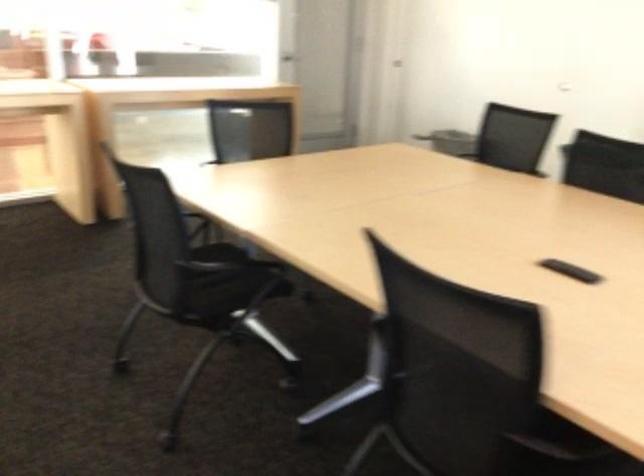
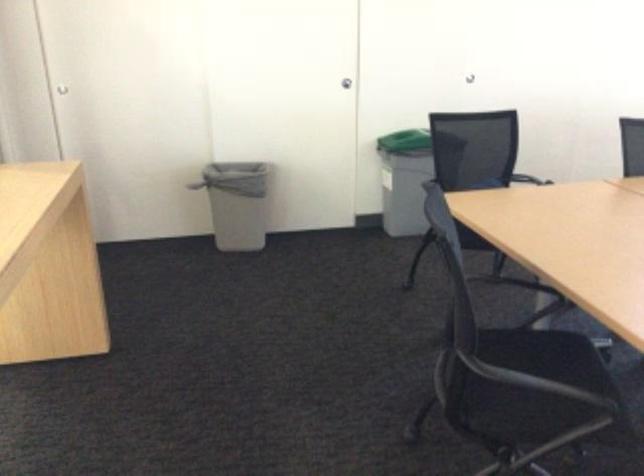
Locate, in the second image, the point that corresponds to point (260, 171) in the first image.

(542, 347)